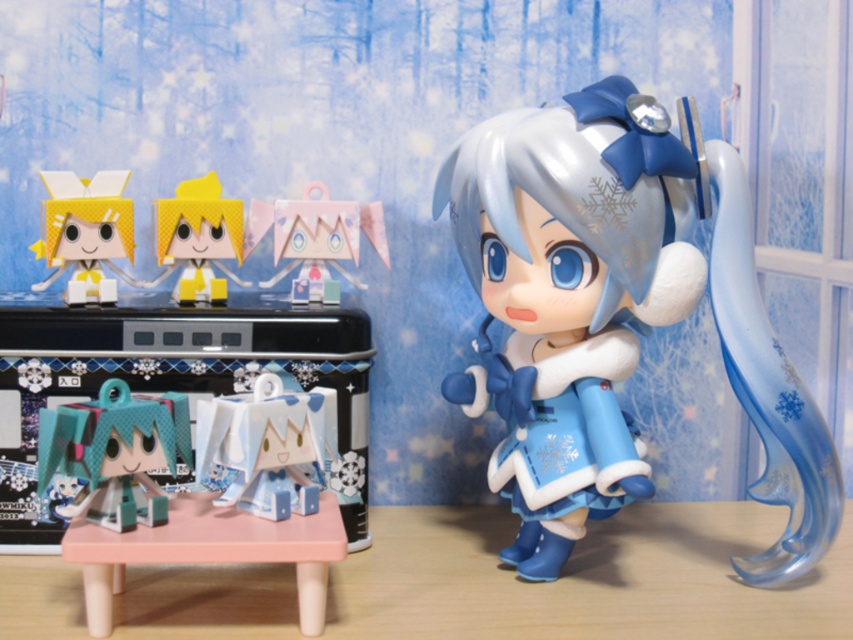
Which is above, satin blue doll at right or translucent plastic figure at center?

Positioned higher is satin blue doll at right.

At what (x,y) coordinates should I click in order to perform the action: click on satin blue doll at right. Please return your answer as a coordinate pair (x, y). The height and width of the screenshot is (640, 853). Looking at the image, I should click on (618, 312).

Looking at this image, between satin blue doll at right and yellow matte toy at center, which one appears on the right side from the viewer's perspective?

satin blue doll at right is more to the right.

Where is `satin blue doll at right`? The height and width of the screenshot is (640, 853). satin blue doll at right is located at coordinates (618, 312).

Between satin blue doll at right and yellow paper doll at upper left, which one appears on the left side from the viewer's perspective?

Positioned to the left is yellow paper doll at upper left.

Between point (640, 145) and point (83, 282), which one is positioned in front?

Point (640, 145) is in front.

The height and width of the screenshot is (640, 853). In order to click on satin blue doll at right in this screenshot , I will do coord(618,312).